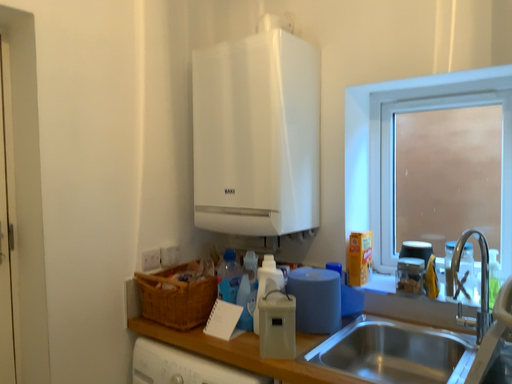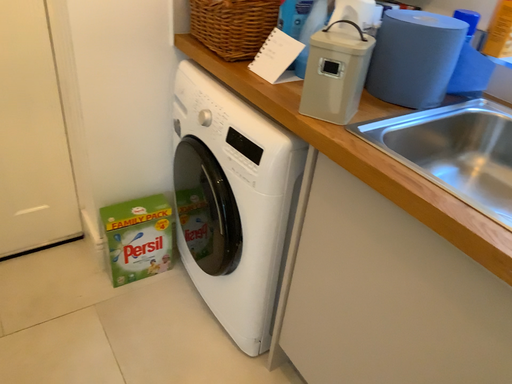
Question: Which way did the camera rotate in the video?

Choices:
 (A) rotated left
 (B) rotated right

Answer: (A)